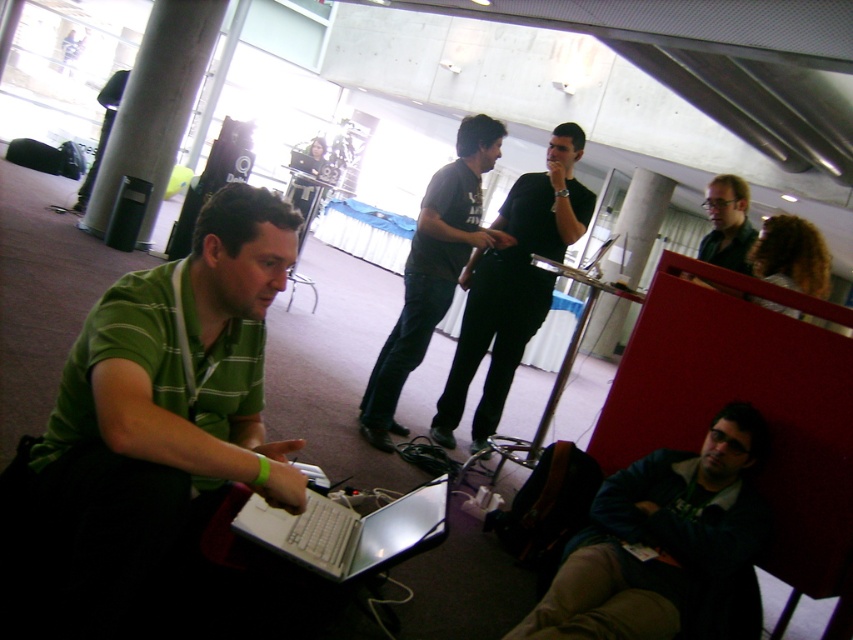
You are standing in the conference room and need to locate two people. The first is wearing a green striped shirt at left, and the second is wearing a matte black shirt at upper right. Which person is positioned further to the left?

The green striped shirt at left is positioned further to the left compared to the matte black shirt at upper right.